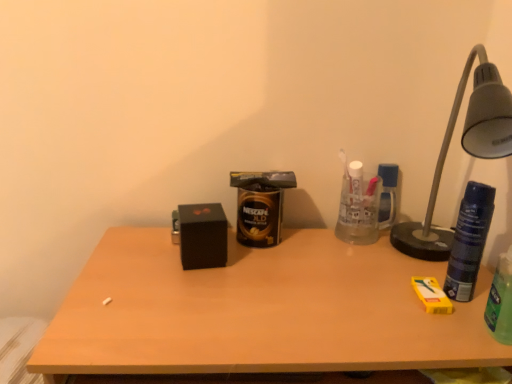
Locate an element on the screen. Image resolution: width=512 pixels, height=384 pixels. free space between green plastic bottle at right, the first beverage in the front-to-back sequence, and black matte box at center is located at coordinates (325, 287).